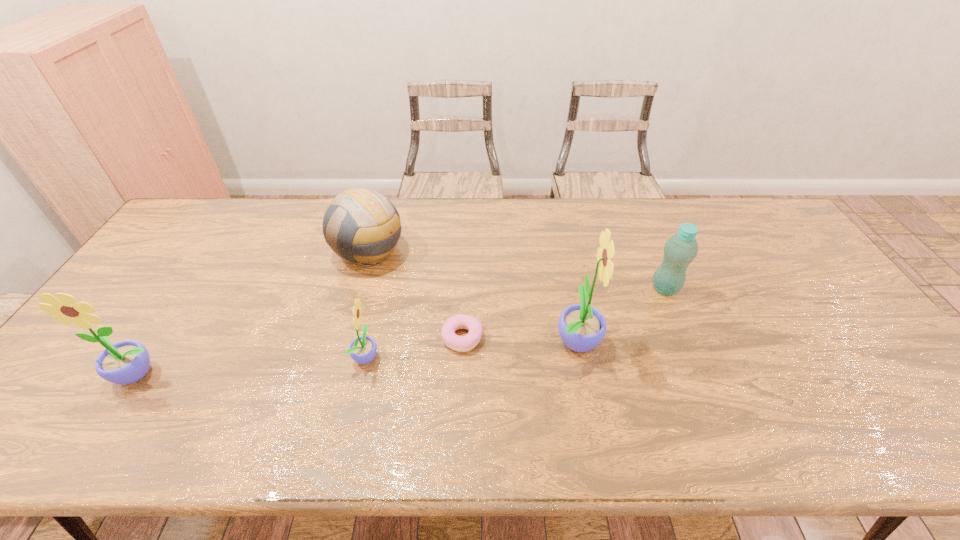
Identify the location of the leftmost sunflower. The image size is (960, 540). (126, 362).

Identify the location of the leftmost object. The image size is (960, 540). (126, 362).

The image size is (960, 540). In order to click on the shortest sunflower in this screenshot , I will do `click(363, 349)`.

Locate an element on the screen. The height and width of the screenshot is (540, 960). the second object from right to left is located at coordinates [582, 327].

I want to click on water bottle, so click(x=680, y=250).

At what (x,y) coordinates should I click in order to perform the action: click on the fifth nearest object. Please return your answer as a coordinate pair (x, y). The image size is (960, 540). Looking at the image, I should click on (x=680, y=250).

Where is `the farthest object`? The height and width of the screenshot is (540, 960). the farthest object is located at coordinates (360, 225).

Image resolution: width=960 pixels, height=540 pixels. In order to click on pastry in this screenshot , I will do `click(455, 342)`.

This screenshot has height=540, width=960. I want to click on the shortest object, so click(455, 342).

You are a GUI agent. You are given a task and a screenshot of the screen. Output one action in this format:
    pyautogui.click(x=<x>, y=<y>)
    Task: Click on the vacant space located on the front-facing side of the shortest sunflower
    The image size is (960, 540).
    Given the screenshot: What is the action you would take?
    click(x=474, y=356)